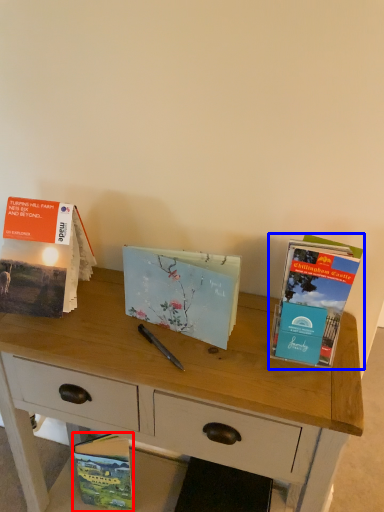
Question: Which point is closer to the camera, book (highlighted by a red box) or book (highlighted by a blue box)?

Choices:
 (A) book
 (B) book

Answer: (B)